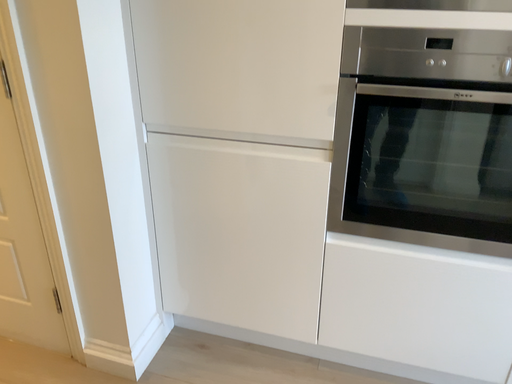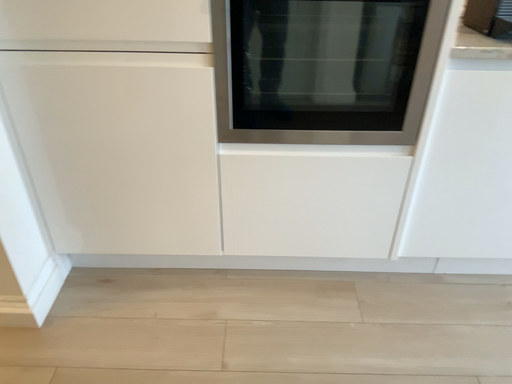
Question: How did the camera likely rotate when shooting the video?

Choices:
 (A) rotated left
 (B) rotated right

Answer: (B)